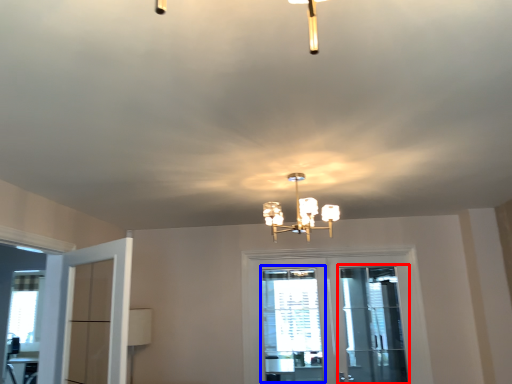
Question: Which of the following is the closest to the observer, screen door (highlighted by a red box) or window (highlighted by a blue box)?

Choices:
 (A) screen door
 (B) window

Answer: (A)